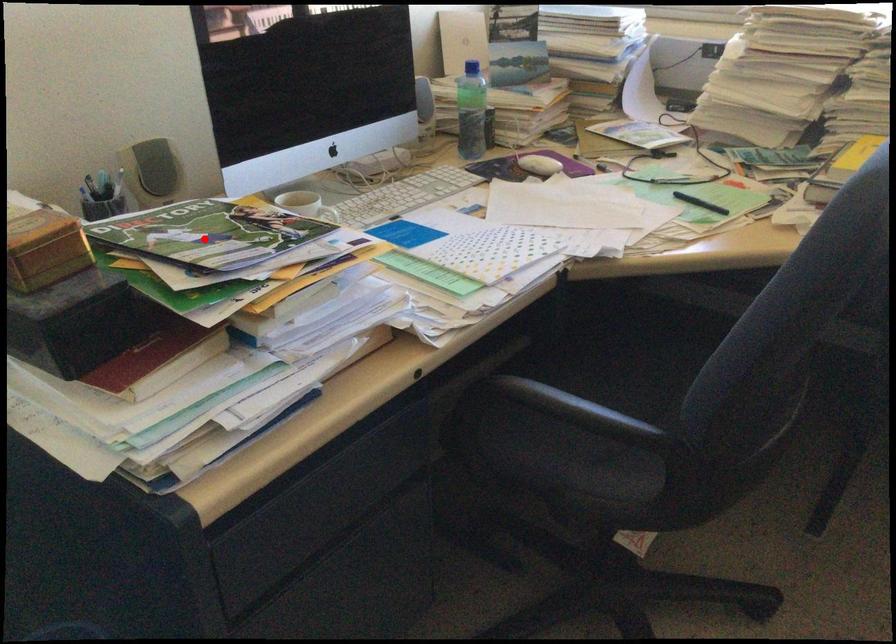
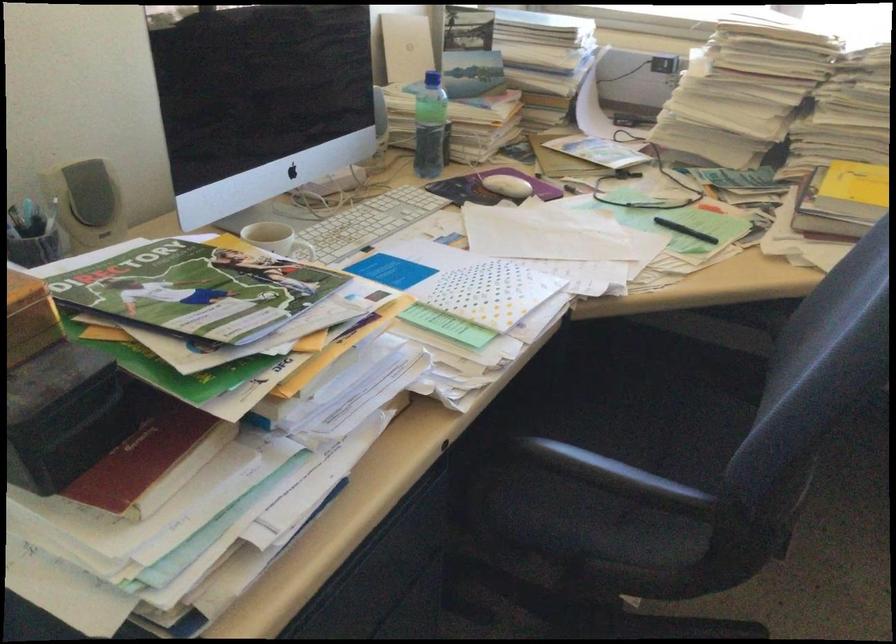
Find the pixel in the second image that matches the highlighted location in the first image.

(195, 290)